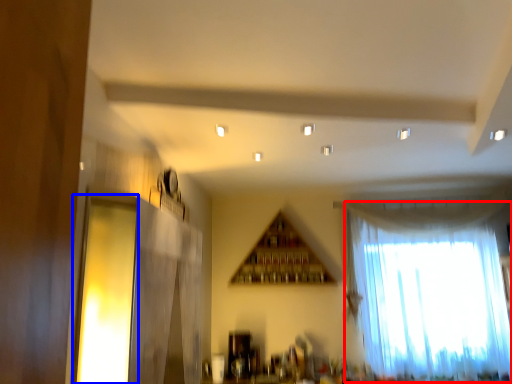
Question: Which object appears closest to the camera in this image, curtain (highlighted by a red box) or window (highlighted by a blue box)?

Choices:
 (A) curtain
 (B) window

Answer: (B)